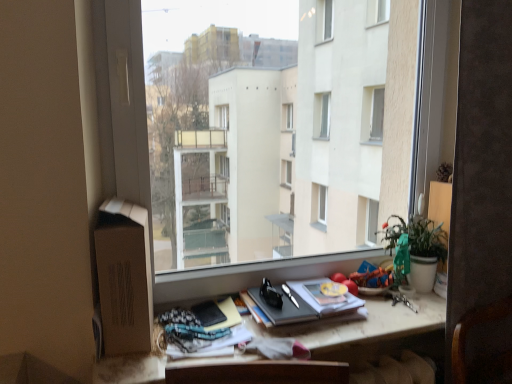
What is the approximate height of matte wooden desk at center?

matte wooden desk at center is 1.91 inches tall.

Describe the element at coordinates (381, 324) in the screenshot. I see `matte wooden desk at center` at that location.

Looking at this image, in order to face green matte plant at right, should I rotate leftwards or rightwards?

Rotate your view right by about 20.140°.

In order to face matte black notebook at lower center, the 1th paperback book in the left-to-right sequence, should I rotate leftwards or rightwards?

You should rotate left by 6.105 degrees.

At what (x,y) coordinates should I click in order to perform the action: click on transparent glass window at center. Please return your answer as a coordinate pair (x, y). Looking at the image, I should click on (263, 137).

In order to face transparent glass window at center, should I rotate leftwards or rightwards?

You should rotate right by 6.996 degrees.

Image resolution: width=512 pixels, height=384 pixels. I want to click on matte wooden desk at center, so click(x=381, y=324).

Which is behind, point (400, 322) or point (435, 144)?

Positioned behind is point (435, 144).

Considering the relative sizes of matte wooden desk at center and transparent glass window at center in the image provided, is matte wooden desk at center bigger than transparent glass window at center?

No.

Is matte wooden desk at center turned away from transparent glass window at center?

No, matte wooden desk at center's orientation is not away from transparent glass window at center.

Considering the relative positions of matte wooden desk at center and transparent glass window at center in the image provided, is matte wooden desk at center behind transparent glass window at center?

Yes, matte wooden desk at center is further from the viewer.

Can you see hardcover book at center, which is counted as the second paperback book, starting from the left, touching transparent glass window at center?

hardcover book at center, which is counted as the second paperback book, starting from the left, is not next to transparent glass window at center, and they're not touching.

From the image's perspective, is hardcover book at center, which is counted as the second paperback book, starting from the left, below transparent glass window at center?

Indeed, from the image's perspective, hardcover book at center, which is counted as the second paperback book, starting from the left, is shown beneath transparent glass window at center.

Can you confirm if hardcover book at center, which ranks as the 1th paperback book in right-to-left order, is thinner than transparent glass window at center?

Yes, hardcover book at center, which ranks as the 1th paperback book in right-to-left order, is thinner than transparent glass window at center.

Is hardcover book at center, which is counted as the second paperback book, starting from the left, looking in the opposite direction of transparent glass window at center?

Yes, transparent glass window at center is at the back of hardcover book at center, which is counted as the second paperback book, starting from the left.

The height and width of the screenshot is (384, 512). Identify the location of window in front of the green matte plant at right. (263, 137).

Can you confirm if green matte plant at right is bigger than transparent glass window at center?

Actually, green matte plant at right might be smaller than transparent glass window at center.

Is point (416, 236) closer to viewer compared to point (359, 185)?

Yes, point (416, 236) is in front of point (359, 185).

Is transparent glass window at center located outside matte black notebook at lower center, positioned as the second paperback book in right-to-left order?

Yes.

Locate an element on the screen. the 2nd paperback book below the transparent glass window at center (from a real-world perspective) is located at coordinates (208, 313).

From a real-world perspective, is transparent glass window at center positioned above or below matte black notebook at lower center, positioned as the second paperback book in right-to-left order?

Clearly, from a real-world perspective, transparent glass window at center is above matte black notebook at lower center, positioned as the second paperback book in right-to-left order.

Is transparent glass window at center facing away from matte black notebook at lower center, positioned as the second paperback book in right-to-left order?

No, matte black notebook at lower center, positioned as the second paperback book in right-to-left order, is not at the back of transparent glass window at center.

Considering the positions of points (392, 312) and (205, 316), is point (392, 312) farther from camera compared to point (205, 316)?

Yes, point (392, 312) is farther from viewer.

Is matte wooden desk at center taller or shorter than matte black notebook at lower center, positioned as the second paperback book in right-to-left order?

Clearly, matte wooden desk at center is taller compared to matte black notebook at lower center, positioned as the second paperback book in right-to-left order.

You are a GUI agent. You are given a task and a screenshot of the screen. Output one action in this format:
    pyautogui.click(x=<x>, y=<y>)
    Task: Click on the 2nd paperback book behind the matte wooden desk at center, starting your count from the anchor
    The height and width of the screenshot is (384, 512).
    Given the screenshot: What is the action you would take?
    pyautogui.click(x=208, y=313)

This screenshot has height=384, width=512. Find the location of `paperback book below the hardcover book at center, which is counted as the second paperback book, starting from the left (from a real-world perspective)`. paperback book below the hardcover book at center, which is counted as the second paperback book, starting from the left (from a real-world perspective) is located at coordinates (208, 313).

Does hardcover book at center, which ranks as the 1th paperback book in right-to-left order, turn towards matte black notebook at lower center, the 1th paperback book in the left-to-right sequence?

No, hardcover book at center, which ranks as the 1th paperback book in right-to-left order, is not facing towards matte black notebook at lower center, the 1th paperback book in the left-to-right sequence.

From the image's perspective, is hardcover book at center, which is counted as the second paperback book, starting from the left, below matte black notebook at lower center, the 1th paperback book in the left-to-right sequence?

No, from the image's perspective, hardcover book at center, which is counted as the second paperback book, starting from the left, is not beneath matte black notebook at lower center, the 1th paperback book in the left-to-right sequence.

Does point (278, 290) lie behind point (223, 320)?

Yes, point (278, 290) is farther from viewer.

Which is correct: matte black notebook at lower center, positioned as the second paperback book in right-to-left order, is inside green matte plant at right, or outside of it?

matte black notebook at lower center, positioned as the second paperback book in right-to-left order, is not enclosed by green matte plant at right.

From a real-world perspective, who is located higher, matte black notebook at lower center, the 1th paperback book in the left-to-right sequence, or green matte plant at right?

green matte plant at right, from a real-world perspective.

Is matte black notebook at lower center, positioned as the second paperback book in right-to-left order, oriented towards green matte plant at right?

No.

From the image's perspective, which one is positioned lower, matte black notebook at lower center, positioned as the second paperback book in right-to-left order, or green matte plant at right?

matte black notebook at lower center, positioned as the second paperback book in right-to-left order, from the image's perspective.

In the image, there is a matte wooden desk at center. Where is `window above it (from the image's perspective)`? This screenshot has height=384, width=512. window above it (from the image's perspective) is located at coordinates (263, 137).

Locate an element on the screen. window that appears in front of the hardcover book at center, which is counted as the second paperback book, starting from the left is located at coordinates (263, 137).

Estimate the real-world distances between objects in this image. Which object is closer to matte black notebook at lower center, the 1th paperback book in the left-to-right sequence, green matte plant at right or hardcover book at center, which is counted as the second paperback book, starting from the left?

hardcover book at center, which is counted as the second paperback book, starting from the left, is closer to matte black notebook at lower center, the 1th paperback book in the left-to-right sequence.

Looking at the image, which one is located further to matte wooden desk at center, transparent glass window at center or matte black notebook at lower center, positioned as the second paperback book in right-to-left order?

Among the two, transparent glass window at center is located further to matte wooden desk at center.

Looking at the image, which one is located further to green matte plant at right, matte wooden desk at center or transparent glass window at center?

The object further to green matte plant at right is transparent glass window at center.

Based on the photo, which object lies nearer to the anchor point hardcover book at center, which ranks as the 1th paperback book in right-to-left order, green matte plant at right or transparent glass window at center?

Among the two, green matte plant at right is located nearer to hardcover book at center, which ranks as the 1th paperback book in right-to-left order.

When comparing their distances from matte wooden desk at center, does matte black notebook at lower center, the 1th paperback book in the left-to-right sequence, or transparent glass window at center seem further?

transparent glass window at center lies further to matte wooden desk at center than the other object.

Considering their positions, is green matte plant at right positioned closer to matte wooden desk at center than matte black notebook at lower center, positioned as the second paperback book in right-to-left order?

Based on the image, green matte plant at right appears to be nearer to matte wooden desk at center.

Which object lies nearer to the anchor point matte wooden desk at center, hardcover book at center, which ranks as the 1th paperback book in right-to-left order, or matte black notebook at lower center, positioned as the second paperback book in right-to-left order?

hardcover book at center, which ranks as the 1th paperback book in right-to-left order, lies closer to matte wooden desk at center than the other object.

Based on their spatial positions, is matte black notebook at lower center, the 1th paperback book in the left-to-right sequence, or hardcover book at center, which is counted as the second paperback book, starting from the left, further from matte wooden desk at center?

The object further to matte wooden desk at center is matte black notebook at lower center, the 1th paperback book in the left-to-right sequence.

Identify the location of houseplant between transparent glass window at center and hardcover book at center, which ranks as the 1th paperback book in right-to-left order, from top to bottom. The height and width of the screenshot is (384, 512). (424, 252).

Locate an element on the screen. The width and height of the screenshot is (512, 384). houseplant between transparent glass window at center and matte wooden desk at center vertically is located at coordinates (424, 252).

This screenshot has height=384, width=512. I want to click on desk between matte black notebook at lower center, the 1th paperback book in the left-to-right sequence, and hardcover book at center, which is counted as the second paperback book, starting from the left, so click(x=381, y=324).

You are a GUI agent. You are given a task and a screenshot of the screen. Output one action in this format:
    pyautogui.click(x=<x>, y=<y>)
    Task: Click on the desk between matte black notebook at lower center, the 1th paperback book in the left-to-right sequence, and green matte plant at right
    This screenshot has height=384, width=512.
    Given the screenshot: What is the action you would take?
    pyautogui.click(x=381, y=324)